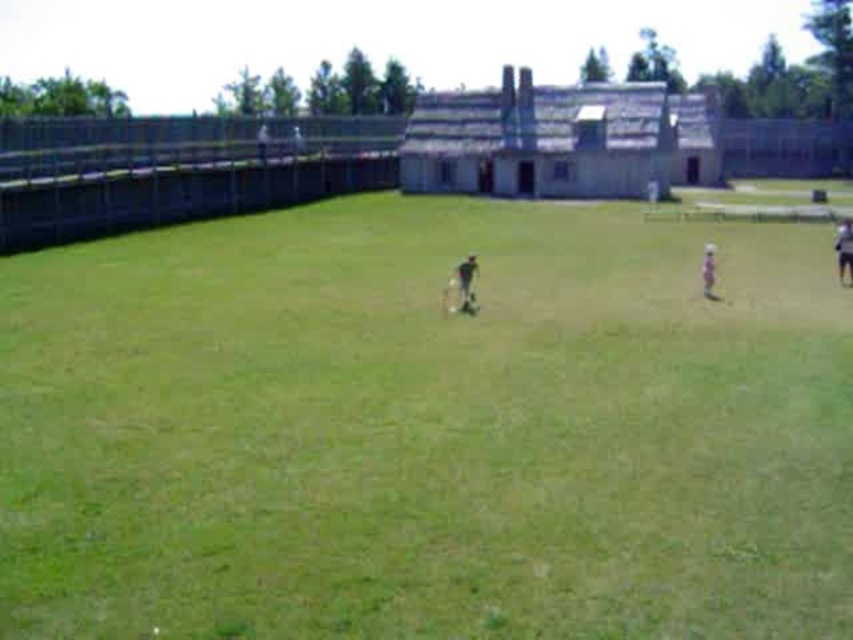
Which of these two, light brown fabric person at center or dark gray uniform at center, stands taller?

Standing taller between the two is light brown fabric person at center.

Which is behind, point (711, 292) or point (264, 154)?

The point (264, 154) is more distant.

This screenshot has height=640, width=853. In order to click on light brown fabric person at center in this screenshot , I will do `click(708, 272)`.

Does dark gray fabric person at center appear over dark blue fabric person at right?

No, dark gray fabric person at center is not above dark blue fabric person at right.

Is dark gray fabric person at center bigger than dark blue fabric person at right?

Incorrect, dark gray fabric person at center is not larger than dark blue fabric person at right.

Who is more forward, (459, 273) or (849, 221)?

Point (459, 273) is in front.

Find the location of a particular element. This screenshot has width=853, height=640. dark gray fabric person at center is located at coordinates (465, 282).

Is green grass at center below dark gray fabric person at center?

Indeed, green grass at center is positioned under dark gray fabric person at center.

Who is more distant from viewer, (x=26, y=276) or (x=462, y=284)?

Point (x=26, y=276)

Is point (233, 240) positioned in front of point (465, 289)?

That is False.

This screenshot has width=853, height=640. What are the coordinates of `green grass at center` in the screenshot? It's located at (426, 428).